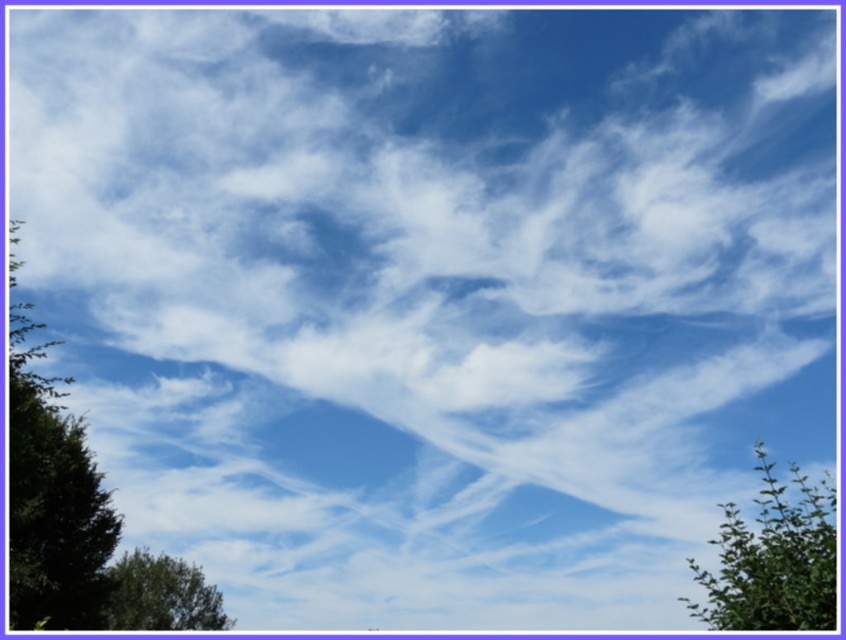
You are standing in a field looking up at the sky with two green leafy trees framing your view. Which tree, the green leafy tree at lower right or the green leafy tree at lower left, would appear larger to you?

The green leafy tree at lower right appears larger because it is closer to the viewer compared to the green leafy tree at lower left.

You are a bird trying to find a nesting spot between the green leafy tree at left and the green leafy tree at lower right. Which tree would you choose if you prefer a wider branch area for your nest?

The green leafy tree at left has a greater width than the green leafy tree at lower right, so you should choose the green leafy tree at left for a wider branch area to build your nest.